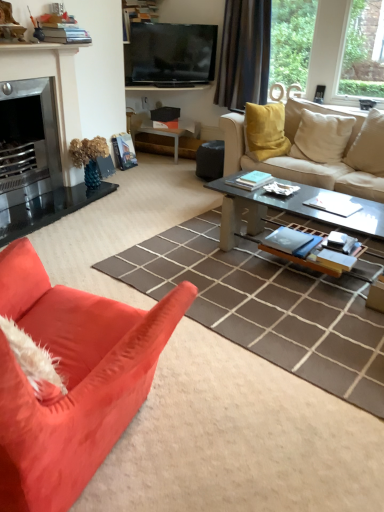
Identify the location of free space to the left of beige fabric couch at upper right, the 2th studio couch when ordered from front to back. (162, 206).